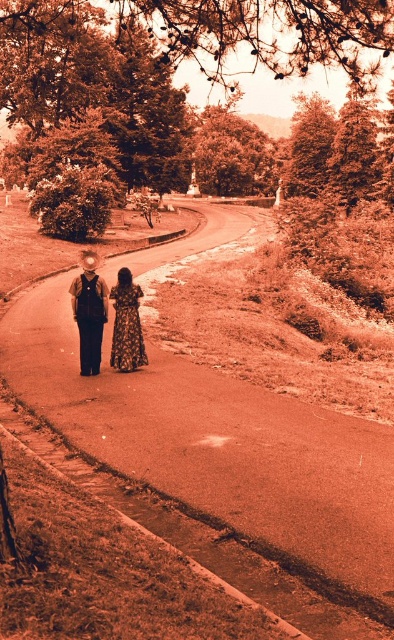
You are standing at the starting point of the pathway. Looking ahead, you see a smooth asphalt road at center located at point (x=221, y=451). If you walk straight ahead, will you eventually reach the smooth asphalt road at center?

Yes, because the smooth asphalt road at center is located at point (x=221, y=451), which is along the pathway you are walking on.

You are a photographer standing at the camera position. You want to take a closeup shot of the matte black dress at center. The camera lens has a maximum zoom range of 12 meters. Can you capture the dress in focus without moving closer?

The matte black dress at center is 13.45 meters from camera. Since the camera lens has a maximum zoom range of 12 meters, it cannot focus on the dress at that distance. You need to move closer or use a different lens with a longer zoom range.